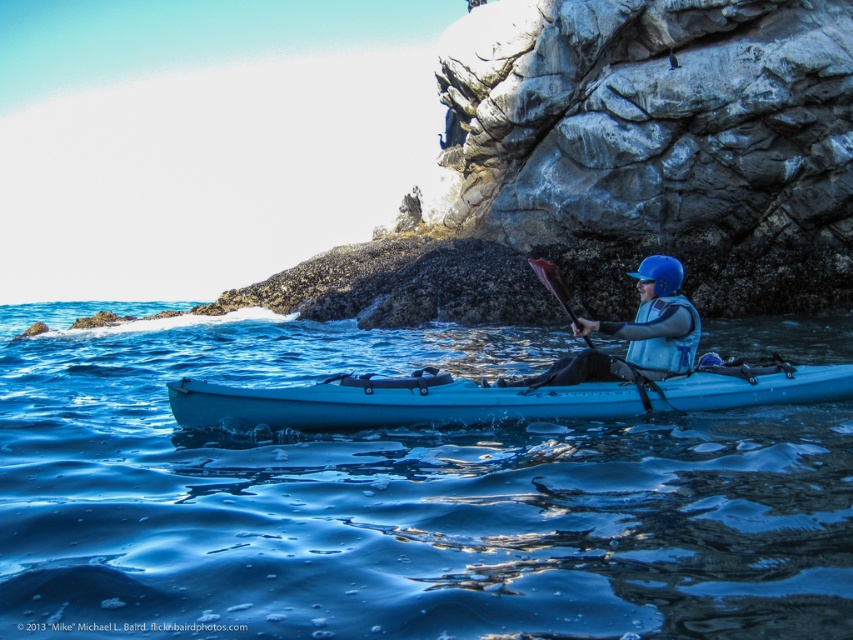
You are planning to kayak in the serene coastal area shown in the image. You see the blue glossy water at center and the light blue plastic canoe at center. Which one of these two objects takes up more space in the image?

The blue glossy water at center is bigger than the light blue plastic canoe at center, so the blue glossy water at center takes up more space in the image.

Based on the photo, you are navigating a kayak and want to reach a point in the water. There are two points marked on your map as point 1 and point 2. Point 1 is at coordinates (125, 516) and point 2 is at (660, 336). Based on the scene, which point is closer to your current position in the kayak?

Point 1 is in front of point 2, so it is closer to your current position in the kayak.